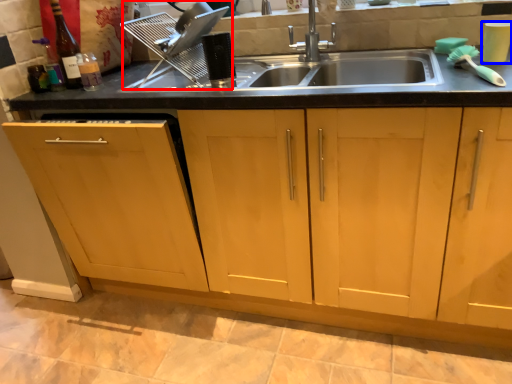
Question: Among these objects, which one is farthest to the camera, appliance (highlighted by a red box) or appliance (highlighted by a blue box)?

Choices:
 (A) appliance
 (B) appliance

Answer: (A)